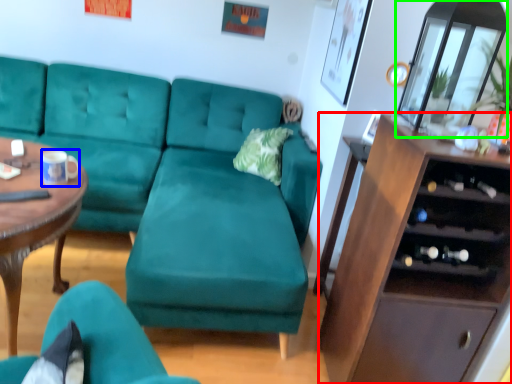
Question: Which object is positioned farthest from cabinetry (highlighted by a red box)? Select from coffee cup (highlighted by a blue box) and glass door (highlighted by a green box).

Choices:
 (A) coffee cup
 (B) glass door

Answer: (A)